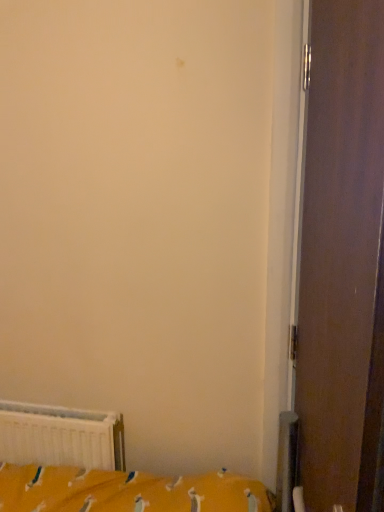
What do you see at coordinates (61, 436) in the screenshot?
I see `white plastic radiator at lower left` at bounding box center [61, 436].

Find the location of a particular element. white plastic radiator at lower left is located at coordinates pyautogui.click(x=61, y=436).

Where is `white plastic radiator at lower left`? Image resolution: width=384 pixels, height=512 pixels. white plastic radiator at lower left is located at coordinates (61, 436).